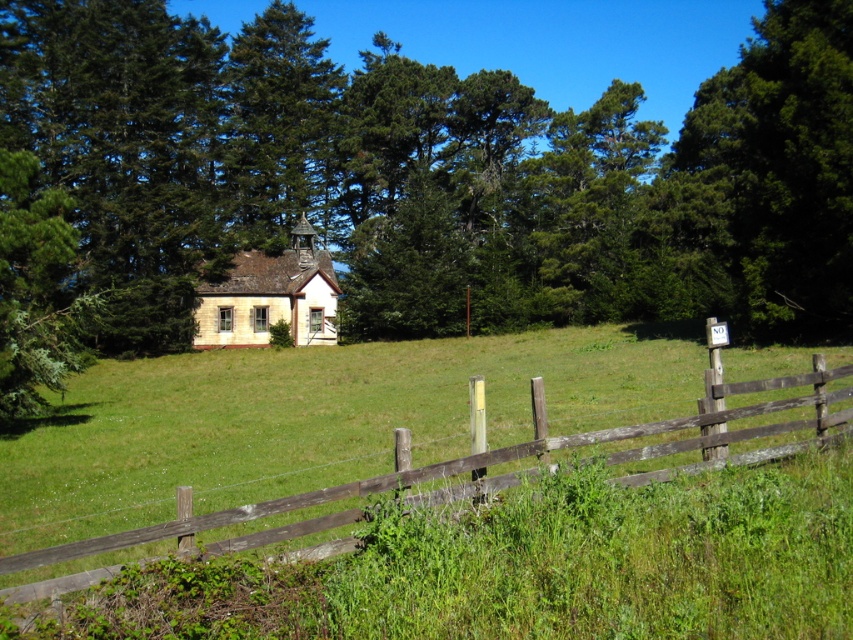
You are standing in front of the house and want to determine the relative positions of two points marked in the image. Which of the two points, point 1 at coordinates (x=74, y=522) or point 2 at coordinates (x=778, y=198), is closer to you?

Point 1 at coordinates (x=74, y=522) is closer to the viewer than point 2 at coordinates (x=778, y=198).

Looking at this image, you are a visitor standing at the entrance of the rural area and want to take a photo of the brown wooden fence at center and the yellow stone church at center. Which object should you focus on first if you want to capture both in a single frame without moving the camera?

The brown wooden fence at center has a lesser height compared to the yellow stone church at center, so you should focus on the brown wooden fence at center first to ensure both are in the frame.